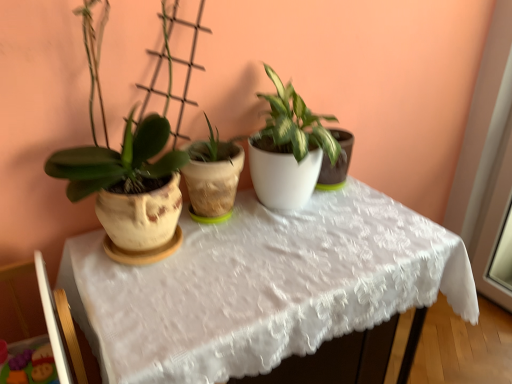
The width and height of the screenshot is (512, 384). What are the coordinates of `free space in front of matte clay pot at left` in the screenshot? It's located at (152, 316).